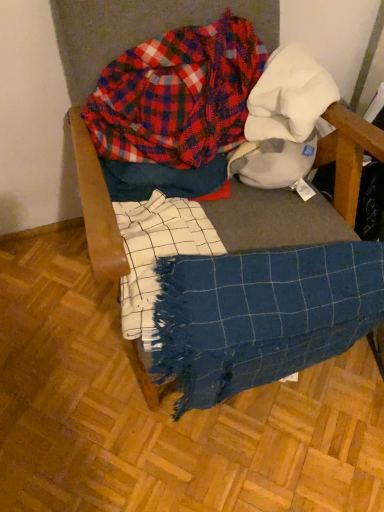
Question: Is blue woven blanket at lower right placed right next to plaid flannel shirt at upper center?

Choices:
 (A) yes
 (B) no

Answer: (B)

Question: From the image's perspective, is blue woven blanket at lower right located beneath plaid flannel shirt at upper center?

Choices:
 (A) no
 (B) yes

Answer: (B)

Question: Is blue woven blanket at lower right positioned in front of plaid flannel shirt at upper center?

Choices:
 (A) no
 (B) yes

Answer: (B)

Question: Is blue woven blanket at lower right positioned beyond the bounds of plaid flannel shirt at upper center?

Choices:
 (A) no
 (B) yes

Answer: (B)

Question: From a real-world perspective, is blue woven blanket at lower right under plaid flannel shirt at upper center?

Choices:
 (A) yes
 (B) no

Answer: (A)

Question: From a real-world perspective, relative to blue woven blanket at center, is blue woven blanket at lower right vertically above or below?

Choices:
 (A) below
 (B) above

Answer: (A)

Question: Visually, is blue woven blanket at lower right positioned to the left or to the right of blue woven blanket at center?

Choices:
 (A) right
 (B) left

Answer: (A)

Question: Is blue woven blanket at lower right in front of or behind blue woven blanket at center in the image?

Choices:
 (A) front
 (B) behind

Answer: (B)

Question: Which is correct: blue woven blanket at lower right is inside blue woven blanket at center, or outside of it?

Choices:
 (A) inside
 (B) outside

Answer: (A)

Question: From their relative heights in the image, would you say plaid flannel shirt at upper center is taller or shorter than blue woven blanket at center?

Choices:
 (A) short
 (B) tall

Answer: (A)

Question: From the image's perspective, is plaid flannel shirt at upper center located above or below blue woven blanket at center?

Choices:
 (A) below
 (B) above

Answer: (B)

Question: Considering the positions of plaid flannel shirt at upper center and blue woven blanket at center in the image, is plaid flannel shirt at upper center bigger or smaller than blue woven blanket at center?

Choices:
 (A) big
 (B) small

Answer: (B)

Question: Considering the positions of point (82, 111) and point (342, 164), is point (82, 111) closer or farther from the camera than point (342, 164)?

Choices:
 (A) closer
 (B) farther

Answer: (B)

Question: From a real-world perspective, is blue woven blanket at center positioned above or below plaid flannel shirt at upper center?

Choices:
 (A) above
 (B) below

Answer: (B)

Question: Is blue woven blanket at center in front of or behind plaid flannel shirt at upper center in the image?

Choices:
 (A) front
 (B) behind

Answer: (A)